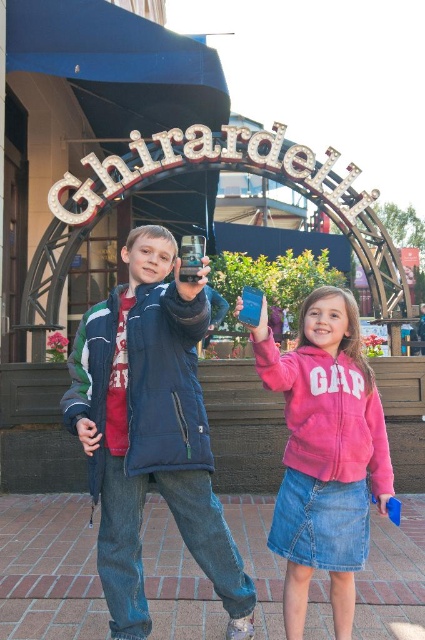
Question: Can you confirm if matte blue jacket at center is thinner than pink fleece jacket at center?

Choices:
 (A) yes
 (B) no

Answer: (B)

Question: Among these objects, which one is nearest to the camera?

Choices:
 (A) pink fleece jacket at center
 (B) matte blue jacket at center

Answer: (A)

Question: Which point appears closest to the camera in this image?

Choices:
 (A) (314, 321)
 (B) (136, 358)

Answer: (B)

Question: Which point is closer to the camera?

Choices:
 (A) pink fleece jacket at center
 (B) matte blue jacket at center

Answer: (A)

Question: Is matte blue jacket at center smaller than pink fleece jacket at center?

Choices:
 (A) yes
 (B) no

Answer: (B)

Question: Can you confirm if matte blue jacket at center is thinner than pink fleece jacket at center?

Choices:
 (A) no
 (B) yes

Answer: (A)